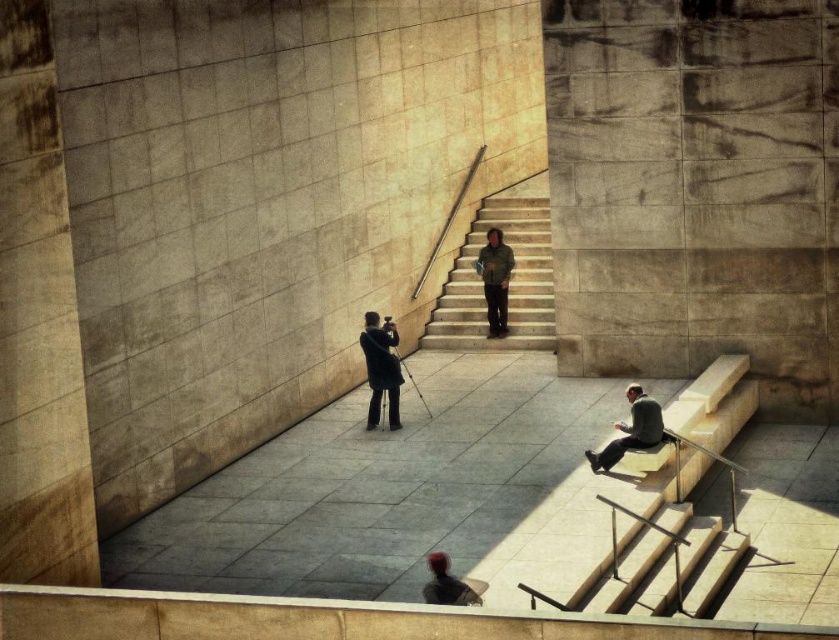
Question: Observing the image, what is the correct spatial positioning of dark gray suit at lower right in reference to green textured jacket at center?

Choices:
 (A) above
 (B) below

Answer: (B)

Question: Can you confirm if dark gray suit at lower right is wider than green textured jacket at center?

Choices:
 (A) no
 (B) yes

Answer: (B)

Question: Based on their relative distances, which object is farther from the shiny black hair at lower center?

Choices:
 (A) green textured jacket at center
 (B) smooth concrete pillar at left
 (C) dark gray suit at lower right
 (D) smooth concrete stairs at center

Answer: (D)

Question: Does matte black camera at center appear over green textured jacket at center?

Choices:
 (A) yes
 (B) no

Answer: (B)

Question: Among these points, which one is nearest to the camera?

Choices:
 (A) (632, 438)
 (B) (426, 556)
 (C) (45, 144)

Answer: (C)

Question: Which object is farther from the camera taking this photo?

Choices:
 (A) matte black camera at center
 (B) dark gray suit at lower right
 (C) smooth concrete pillar at left

Answer: (A)